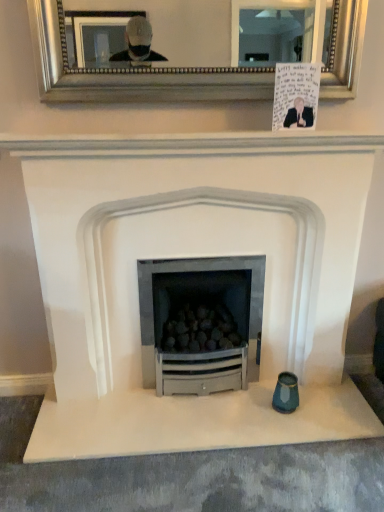
Question: Is handwritten paper at upper center inside the boundaries of white matte fireplace at center, or outside?

Choices:
 (A) outside
 (B) inside

Answer: (A)

Question: Is handwritten paper at upper center to the left or to the right of white matte fireplace at center in the image?

Choices:
 (A) left
 (B) right

Answer: (B)

Question: Estimate the real-world distances between objects in this image. Which object is farther from the handwritten paper at upper center?

Choices:
 (A) silver/golden mirror at upper center
 (B) white matte fireplace at center

Answer: (B)

Question: Which of these objects is positioned farthest from the white matte fireplace at center?

Choices:
 (A) silver/golden mirror at upper center
 (B) handwritten paper at upper center

Answer: (A)